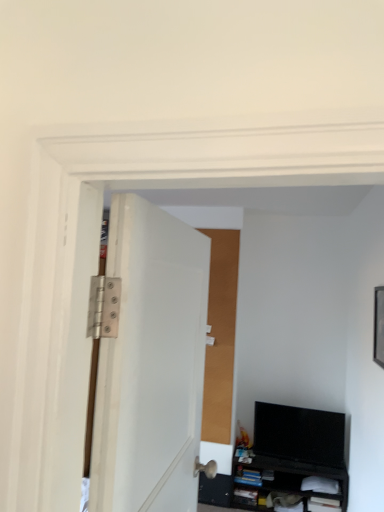
Describe the element at coordinates (151, 364) in the screenshot. I see `white matte door at center` at that location.

Find the location of a particular element. The height and width of the screenshot is (512, 384). black matte cabinet at lower right is located at coordinates (283, 480).

Would you say black glossy tv at lower right is to the left or to the right of white matte door at center in the picture?

In the image, black glossy tv at lower right appears on the right side of white matte door at center.

Who is smaller, black glossy tv at lower right or white matte door at center?

With smaller size is black glossy tv at lower right.

Would you say black glossy tv at lower right is a long distance from white matte door at center?

Yes, black glossy tv at lower right and white matte door at center are located far from each other.

From a real-world perspective, which object rests below the other?

In real-world perspective, black glossy tv at lower right is lower.

Consider the image. Which object is closer to the camera, black matte cabinet at lower right or white matte door at center?

white matte door at center.

Looking at this image, from a real-world perspective, between black matte cabinet at lower right and white matte door at center, who is vertically higher?

From a 3D spatial view, white matte door at center is above.

Based on the photo, from the image's perspective, is black matte cabinet at lower right located above or below white matte door at center?

black matte cabinet at lower right is situated lower than white matte door at center in the image.

Between white matte door at center and black matte cabinet at lower right, which one has larger width?

With larger width is black matte cabinet at lower right.

What's the angular difference between white matte door at center and black matte cabinet at lower right's facing directions?

There is a 90.9-degree angle between the facing directions of white matte door at center and black matte cabinet at lower right.

Which is more to the left, white matte door at center or black matte cabinet at lower right?

From the viewer's perspective, white matte door at center appears more on the left side.

Consider the image. Is white matte door at center far away from black matte cabinet at lower right?

Indeed, white matte door at center is not near black matte cabinet at lower right.

Which of these two, white matte door at center or black glossy tv at lower right, stands taller?

white matte door at center.

Is white matte door at center outside of black glossy tv at lower right?

white matte door at center lies outside black glossy tv at lower right's area.

From the image's perspective, would you say white matte door at center is shown under black glossy tv at lower right?

No.

Which is more to the right, white matte door at center or black glossy tv at lower right?

black glossy tv at lower right.

From a real-world perspective, which is physically above, black matte cabinet at lower right or black glossy tv at lower right?

black glossy tv at lower right.

How different are the orientations of black matte cabinet at lower right and black glossy tv at lower right in degrees?

The facing directions of black matte cabinet at lower right and black glossy tv at lower right are 6.5 degrees apart.

Consider the image. Which object is closer to the camera taking this photo, black matte cabinet at lower right or black glossy tv at lower right?

Positioned in front is black matte cabinet at lower right.

Who is shorter, black matte cabinet at lower right or black glossy tv at lower right?

Standing shorter between the two is black matte cabinet at lower right.

Where is `computer monitor that appears behind the black matte cabinet at lower right`? computer monitor that appears behind the black matte cabinet at lower right is located at coordinates (299, 435).

Is black glossy tv at lower right oriented towards black matte cabinet at lower right?

No.

From a real-world perspective, who is located lower, black glossy tv at lower right or black matte cabinet at lower right?

In real-world perspective, black matte cabinet at lower right is lower.

Where is `door above the black glossy tv at lower right (from a real-world perspective)`? door above the black glossy tv at lower right (from a real-world perspective) is located at coordinates 151,364.

You are a GUI agent. You are given a task and a screenshot of the screen. Output one action in this format:
    pyautogui.click(x=<x>, y=<y>)
    Task: Click on the door on the left side of black matte cabinet at lower right
    
    Given the screenshot: What is the action you would take?
    pyautogui.click(x=151, y=364)

Which object lies nearer to the anchor point black matte cabinet at lower right, black glossy tv at lower right or white matte door at center?

The object closer to black matte cabinet at lower right is black glossy tv at lower right.

Based on the photo, which object lies further to the anchor point white matte door at center, black matte cabinet at lower right or black glossy tv at lower right?

black matte cabinet at lower right.

When comparing their distances from black matte cabinet at lower right, does white matte door at center or black glossy tv at lower right seem closer?

black glossy tv at lower right is closer to black matte cabinet at lower right.

Looking at the image, which one is located further to black glossy tv at lower right, white matte door at center or black matte cabinet at lower right?

white matte door at center is further to black glossy tv at lower right.

Estimate the real-world distances between objects in this image. Which object is further from black glossy tv at lower right, black matte cabinet at lower right or white matte door at center?

Among the two, white matte door at center is located further to black glossy tv at lower right.

Considering their positions, is black glossy tv at lower right positioned closer to white matte door at center than black matte cabinet at lower right?

black glossy tv at lower right is positioned closer to the anchor white matte door at center.

Locate an element on the screen. The width and height of the screenshot is (384, 512). cabinetry between white matte door at center and black glossy tv at lower right from front to back is located at coordinates (x=283, y=480).